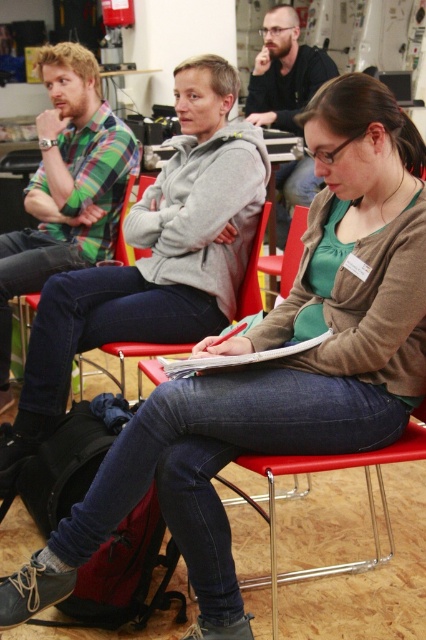
Consider the image. You are organizing a clothing drive and need to determine which item takes up more space in the donation box. Based on the scene, which item between the matte gray hoodie at center and the matte black shirt at center occupies more horizontal space?

The matte gray hoodie at center has a larger width than the matte black shirt at center, so it occupies more horizontal space in the donation box.

You are an attendee at this workshop. You need to hand a document to both the person wearing the matte gray hoodie at center and the person wearing the green plaid shirt at left. Based on their positions, which person is closer to you?

The matte gray hoodie at center is positioned under the green plaid shirt at left, meaning the matte gray hoodie at center is closer to you than the green plaid shirt at left. Therefore, the matte gray hoodie at center is closer.

You are organizing a clothing drive and need to determine which item takes up more space. Based on the scene, which item occupies more space between the matte gray hoodie at center and the matte black shirt at center?

The matte black shirt at center occupies more space because it is larger than the matte gray hoodie at center.